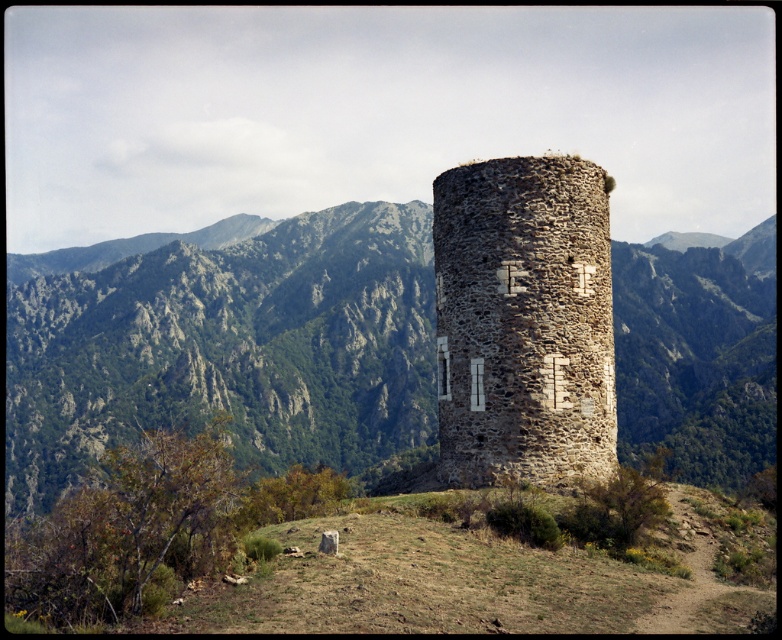
You are an architect examining the image of a stone tower complex. You notice two towers labeled as rugged stone tower at center and rustic stone tower at center. According to the spatial arrangement, which tower is situated higher in elevation?

The rugged stone tower at center is positioned over the rustic stone tower at center, meaning it is higher in elevation.

You are standing at the base of the rugged stone tower at center and want to throw a rock to hit the tower. If your maximum throwing distance is 30 meters, can you reach the tower?

The rugged stone tower at center is 35.61 meters away from the viewer, which exceeds your maximum throwing distance of 30 meters. Therefore, you cannot reach the tower with a throw.